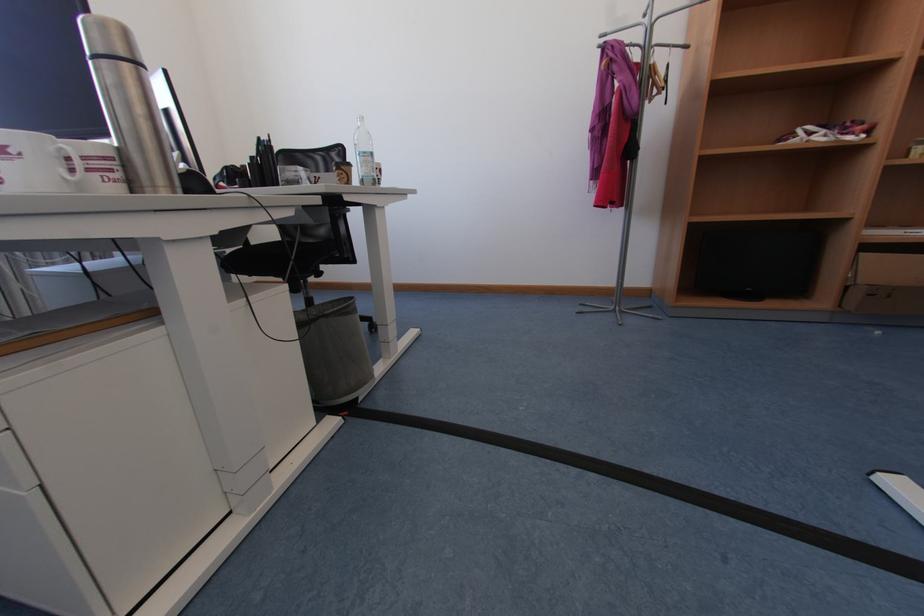
The location [265,169] corresponds to which object?

It corresponds to the black pen holder in the image.